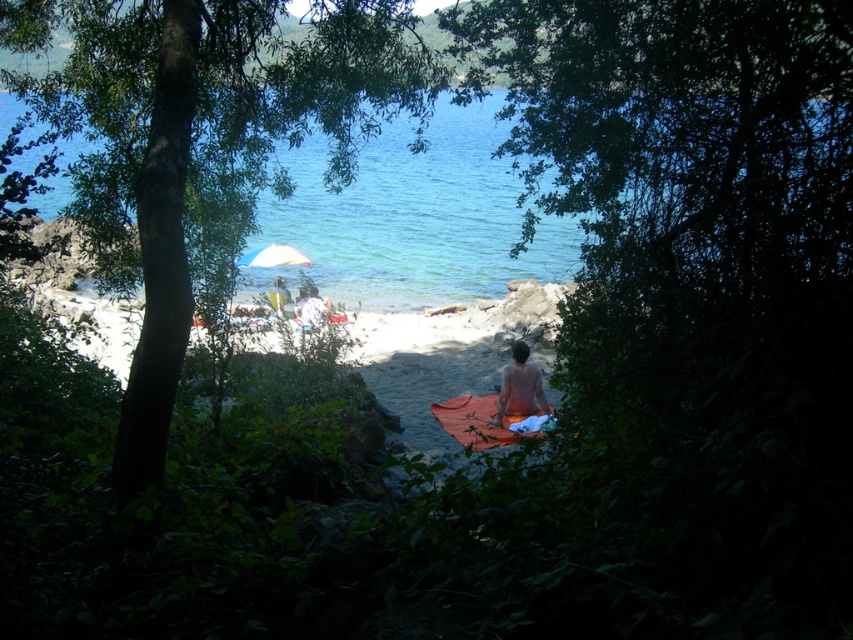
You are standing in the shaded area surrounded by dense green foliage and want to walk towards the clear blue water at center and the shiny brown towel at center. Which one will you reach first?

The clear blue water at center is to the left of shiny brown towel at center, so you will reach the clear blue water at center first since it is closer to your starting position in the shaded area.

You are standing in the shaded area surrounded by dense green foliage and want to walk directly towards the clear blue water at center. Which direction should you walk to reach it?

The clear blue water at center is located at point (416,216), so you should walk towards the center of the scene to reach it.

You are planning to place a rectangular cooler that is 1.2 meters wide between the clear blue water at center and the shiny brown towel at center. Based on their widths, will the cooler fit between them without overlapping either object?

The clear blue water at center is wider than the shiny brown towel at center. Since the cooler is 1.2 meters wide, it depends on the actual widths. However, the description only states the comparison of their widths, not exact measurements. Therefore, we cannot definitively determine if the cooler will fit without more specific width information.